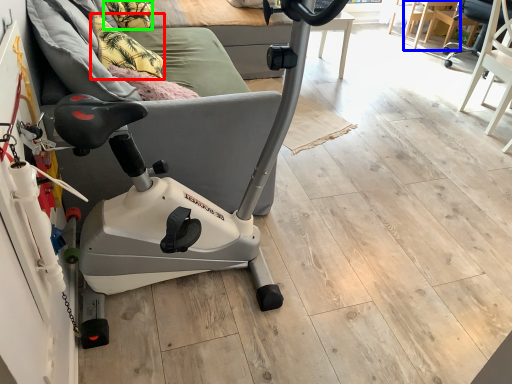
Question: Which object is the farthest from pillow (highlighted by a red box)? Choose among these: table (highlighted by a blue box) or pillow (highlighted by a green box).

Choices:
 (A) table
 (B) pillow

Answer: (A)